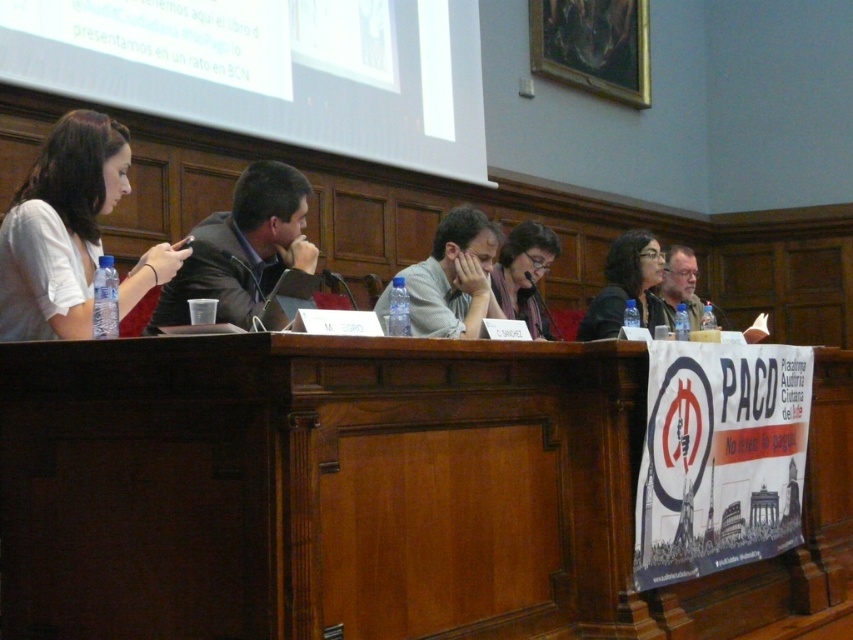
Question: Does brown wood table at center appear on the left side of matte gray shirt at center?

Choices:
 (A) yes
 (B) no

Answer: (B)

Question: Which object appears closest to the camera in this image?

Choices:
 (A) matte gray shirt at center
 (B) gray hair at right

Answer: (A)

Question: Which point appears closest to the camera in this image?

Choices:
 (A) (664, 292)
 (B) (283, 324)

Answer: (B)

Question: Estimate the real-world distances between objects in this image. Which object is closer to the gray hair at right?

Choices:
 (A) matte black jacket at center
 (B) matte gray shirt at center
 (C) matte gray scarf at center

Answer: (A)

Question: From the image, what is the correct spatial relationship of brown wood table at center in relation to matte black jacket at center?

Choices:
 (A) left
 (B) right

Answer: (A)

Question: Does brown wood table at center come behind dark brown suit at center?

Choices:
 (A) no
 (B) yes

Answer: (A)